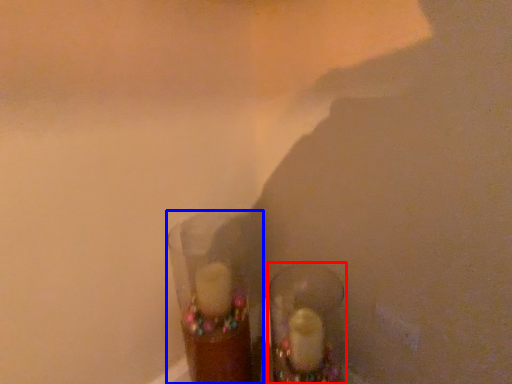
Question: Which object is closer to the camera taking this photo, footwear (highlighted by a red box) or shot glass (highlighted by a blue box)?

Choices:
 (A) footwear
 (B) shot glass

Answer: (B)